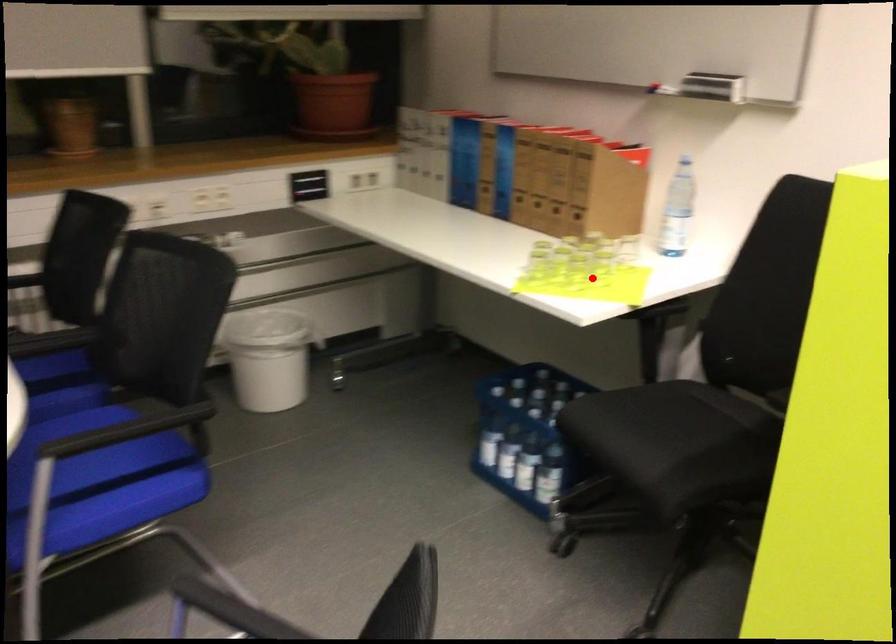
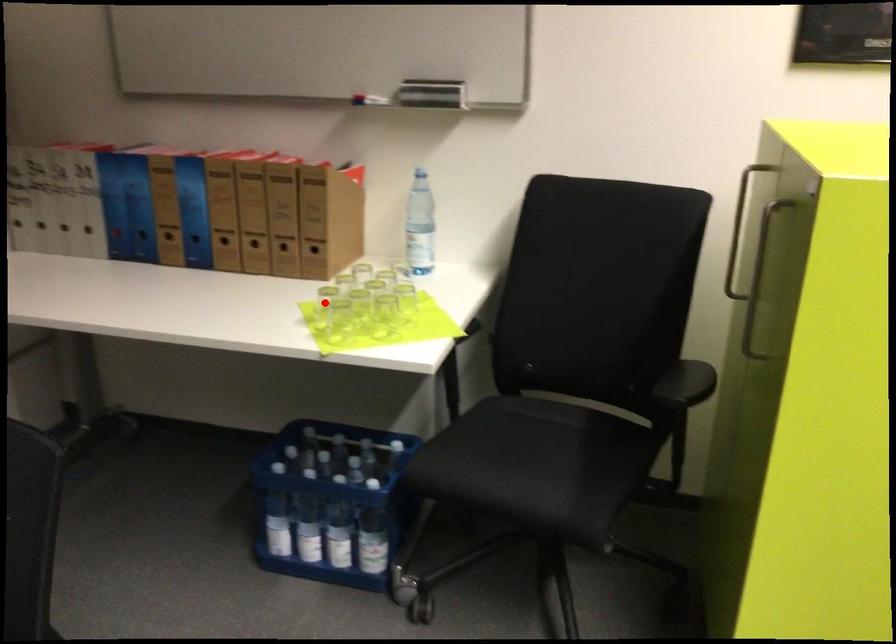
I am providing you with two images of the same scene from different viewpoints. A red point is marked on the first image and another point is marked on the second image. Does the point marked in image1 correspond to the same location as the one in image2?

No